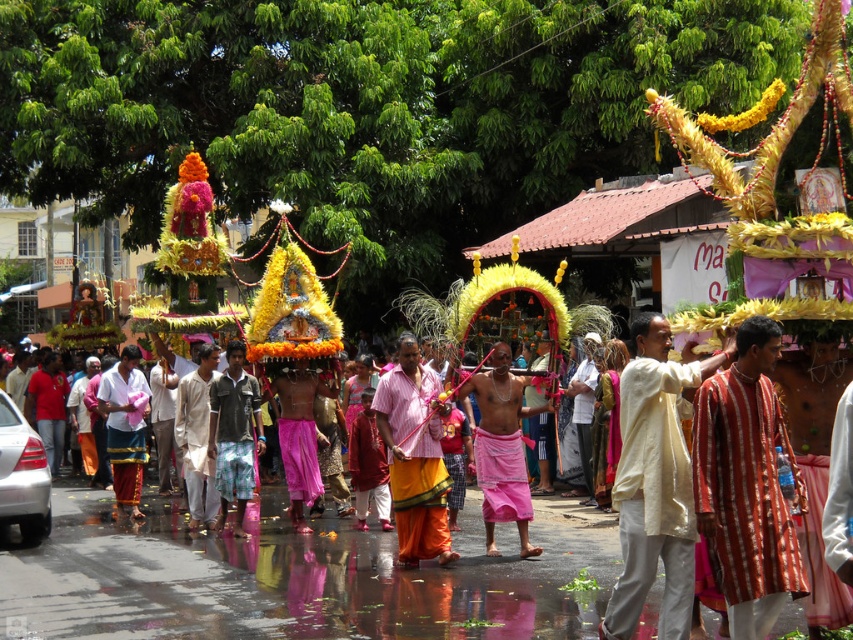
Based on the photo, based on the scene description, where is the white cotton kurta at center located in terms of its 2D coordinates?

The white cotton kurta at center is located at the 2D coordinates point (654, 481).